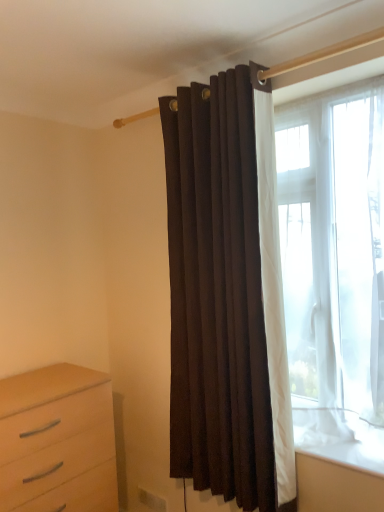
This screenshot has height=512, width=384. Describe the element at coordinates (221, 298) in the screenshot. I see `suede-like brown curtain at center` at that location.

Identify the location of transparent fabric window at right. (334, 267).

Which point is more forward, (268, 485) or (77, 422)?

The point (268, 485) is closer.

From a real-world perspective, which is physically below, suede-like brown curtain at center or light wood chest of drawers at lower left?

In real-world perspective, light wood chest of drawers at lower left is lower.

Is suede-like brown curtain at center smaller than light wood chest of drawers at lower left?

Yes, suede-like brown curtain at center is smaller than light wood chest of drawers at lower left.

Could you tell me if suede-like brown curtain at center is turned towards light wood chest of drawers at lower left?

No, suede-like brown curtain at center does not turn towards light wood chest of drawers at lower left.

Is transparent fabric window at right further to camera compared to suede-like brown curtain at center?

No, it is in front of suede-like brown curtain at center.

Is transparent fabric window at right completely or partially outside of suede-like brown curtain at center?

transparent fabric window at right lies outside suede-like brown curtain at center's area.

Find the location of a particular element. The image size is (384, 512). window on the right of suede-like brown curtain at center is located at coordinates [334, 267].

Which point is more distant from viewer, (358,250) or (201,460)?

The point (201,460) is farther.

Is light wood chest of drawers at lower left not near suede-like brown curtain at center?

That's not correct — light wood chest of drawers at lower left is a little close to suede-like brown curtain at center.

Considering the relative positions of light wood chest of drawers at lower left and suede-like brown curtain at center in the image provided, is light wood chest of drawers at lower left behind suede-like brown curtain at center?

Yes, it is behind suede-like brown curtain at center.

How different are the orientations of light wood chest of drawers at lower left and suede-like brown curtain at center in degrees?

89.5 degrees.

Looking at this image, from the image's perspective, relative to suede-like brown curtain at center, is light wood chest of drawers at lower left above or below?

Based on their image positions, light wood chest of drawers at lower left is located beneath suede-like brown curtain at center.

Consider the image. From a real-world perspective, between light wood chest of drawers at lower left and transparent fabric window at right, who is vertically lower?

light wood chest of drawers at lower left.

Is light wood chest of drawers at lower left to the left or to the right of transparent fabric window at right in the image?

light wood chest of drawers at lower left is positioned on transparent fabric window at right's left side.

From the image's perspective, is light wood chest of drawers at lower left under transparent fabric window at right?

Indeed, from the image's perspective, light wood chest of drawers at lower left is shown beneath transparent fabric window at right.

Between suede-like brown curtain at center and transparent fabric window at right, which one has smaller size?

Smaller between the two is transparent fabric window at right.

Considering the relative positions of suede-like brown curtain at center and transparent fabric window at right in the image provided, is suede-like brown curtain at center to the left or to the right of transparent fabric window at right?

Clearly, suede-like brown curtain at center is on the left of transparent fabric window at right in the image.

From a real-world perspective, who is located lower, suede-like brown curtain at center or transparent fabric window at right?

In real-world perspective, suede-like brown curtain at center is lower.

In terms of size, does transparent fabric window at right appear bigger or smaller than light wood chest of drawers at lower left?

In the image, transparent fabric window at right appears to be smaller than light wood chest of drawers at lower left.

Considering the relative positions of transparent fabric window at right and light wood chest of drawers at lower left in the image provided, is transparent fabric window at right in front of light wood chest of drawers at lower left?

Yes, it is in front of light wood chest of drawers at lower left.

Consider the image. Is transparent fabric window at right looking in the opposite direction of light wood chest of drawers at lower left?

No.

At what (x,y) coordinates should I click in order to perform the action: click on curtain on the right of light wood chest of drawers at lower left. Please return your answer as a coordinate pair (x, y). The width and height of the screenshot is (384, 512). Looking at the image, I should click on (221, 298).

The image size is (384, 512). In the image, there is a transparent fabric window at right. In order to click on curtain below it (from a real-world perspective) in this screenshot , I will do `click(221, 298)`.

Based on the photo, when comparing their distances from suede-like brown curtain at center, does transparent fabric window at right or light wood chest of drawers at lower left seem further?

light wood chest of drawers at lower left lies further to suede-like brown curtain at center than the other object.

Which object lies further to the anchor point light wood chest of drawers at lower left, transparent fabric window at right or suede-like brown curtain at center?

transparent fabric window at right is further to light wood chest of drawers at lower left.

Considering their positions, is light wood chest of drawers at lower left positioned further to suede-like brown curtain at center than transparent fabric window at right?

light wood chest of drawers at lower left lies further to suede-like brown curtain at center than the other object.

Looking at the image, which one is located further to light wood chest of drawers at lower left, suede-like brown curtain at center or transparent fabric window at right?

The object further to light wood chest of drawers at lower left is transparent fabric window at right.

From the image, which object appears to be nearer to transparent fabric window at right, light wood chest of drawers at lower left or suede-like brown curtain at center?

Based on the image, suede-like brown curtain at center appears to be nearer to transparent fabric window at right.

Which object lies nearer to the anchor point transparent fabric window at right, suede-like brown curtain at center or light wood chest of drawers at lower left?

Among the two, suede-like brown curtain at center is located nearer to transparent fabric window at right.

You are a GUI agent. You are given a task and a screenshot of the screen. Output one action in this format:
    pyautogui.click(x=<x>, y=<y>)
    Task: Click on the curtain situated between light wood chest of drawers at lower left and transparent fabric window at right from left to right
    
    Given the screenshot: What is the action you would take?
    pyautogui.click(x=221, y=298)